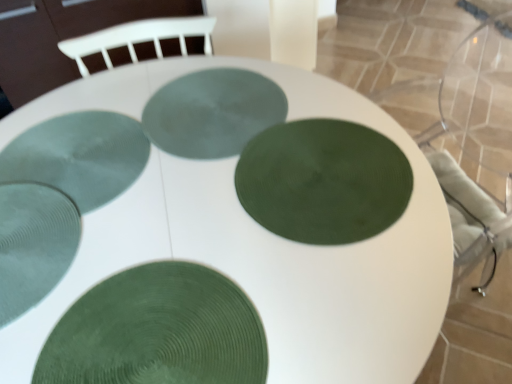
Where is `free space behind green textured glass plate at center, positioned as the 2th glass plate in back-to-front order`? Image resolution: width=512 pixels, height=384 pixels. free space behind green textured glass plate at center, positioned as the 2th glass plate in back-to-front order is located at coordinates (118, 92).